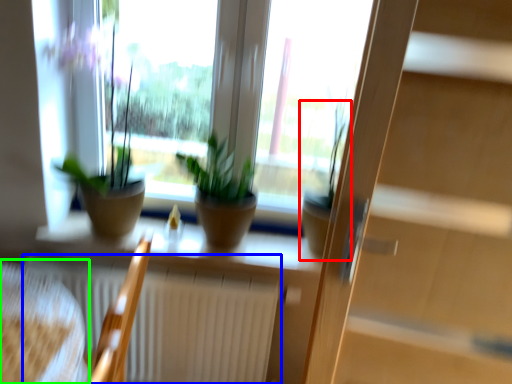
Question: Estimate the real-world distances between objects in this image. Which object is farther from houseplant (highlighted by a red box), radiator (highlighted by a blue box) or armchair (highlighted by a green box)?

Choices:
 (A) radiator
 (B) armchair

Answer: (B)